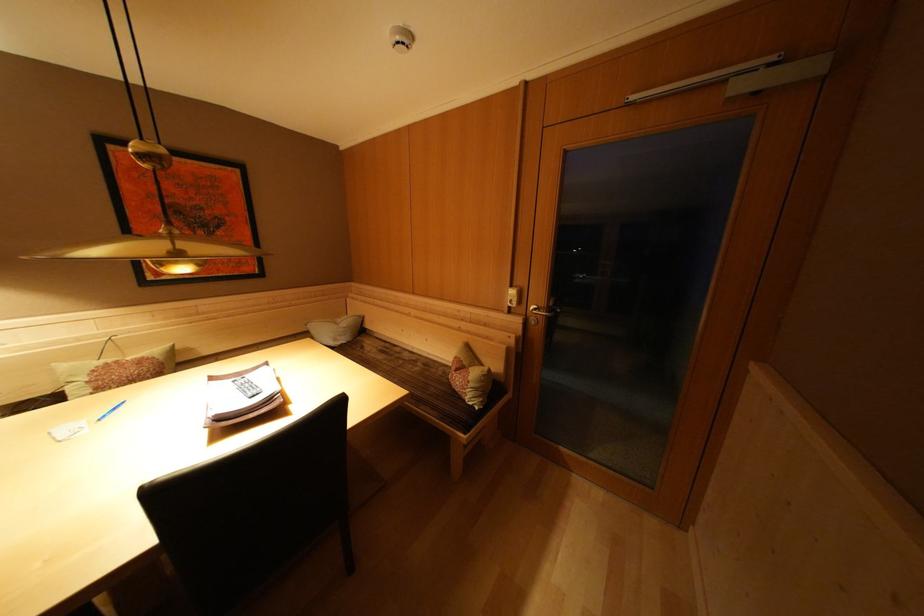
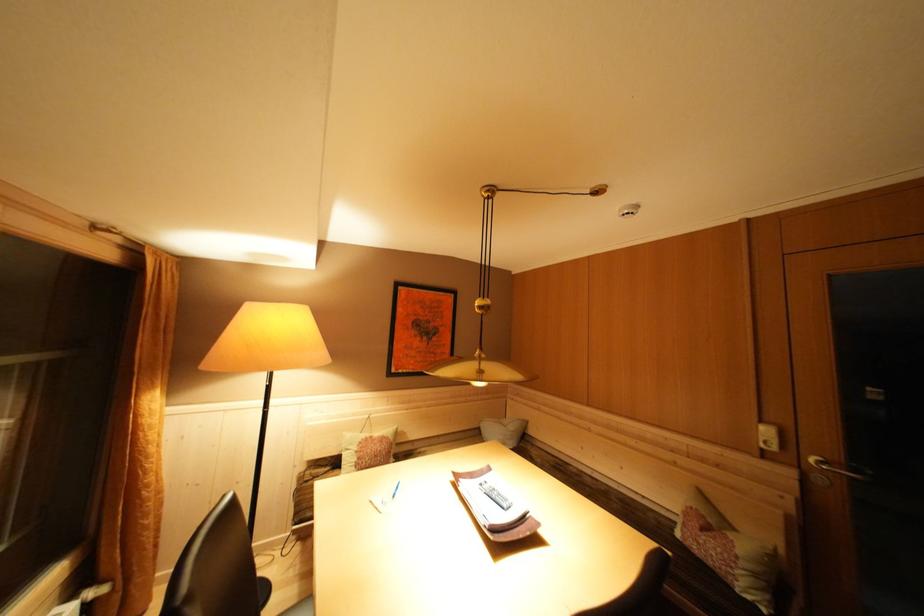
Find the pixel in the second image that matches point 353,326 in the first image.

(518, 430)